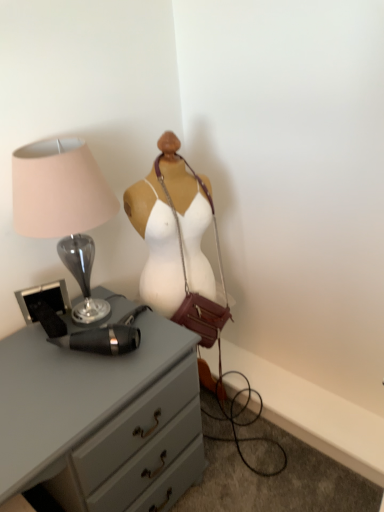
At what (x,y) coordinates should I click in order to perform the action: click on free space in front of matte glass lamp at left. Please return your answer as a coordinate pair (x, y). Looking at the image, I should click on (61, 384).